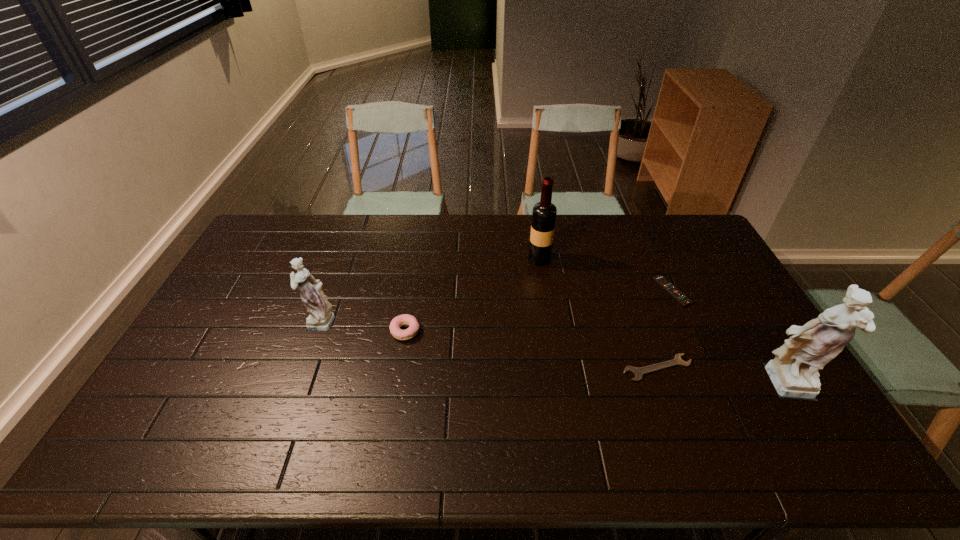
To ensure equal spacing by inserting another figurine among them, please point out a vacant spot for this new figurine. Please provide its 2D coordinates. Your answer should be formatted as a tuple, i.e. [(x, y)], where the tuple contains the x and y coordinates of a point satisfying the conditions above.

[(536, 352)]